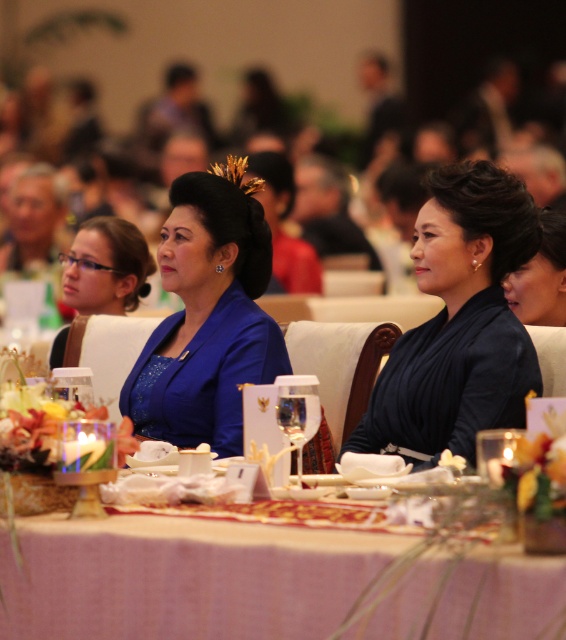
You are standing at the entrance of the banquet hall and want to locate the pink woven tablecloth at lower center. According to the coordinates provided, where would you find it?

The pink woven tablecloth at lower center is located at coordinates point [264,582].

You are a photographer at the event and need to position two subjects, the matte blue dress at center and the black silk dress at right, for a group photo. Based on their current positions, which dress is positioned closer to the camera?

The matte blue dress at center is positioned closer to the camera than the black silk dress at right because it is at the center, which is typically closer in such settings.

You are a guest at this formal event and want to sit down at the table with the pink woven tablecloth at lower center. However, there is a black silk dress at right nearby. Can you sit comfortably without the dress obstructing your path?

The pink woven tablecloth at lower center is positioned under the black silk dress at right, meaning the dress is above the table. Since the dress is likely worn by someone seated at the table, there should be enough space to sit comfortably without obstruction.